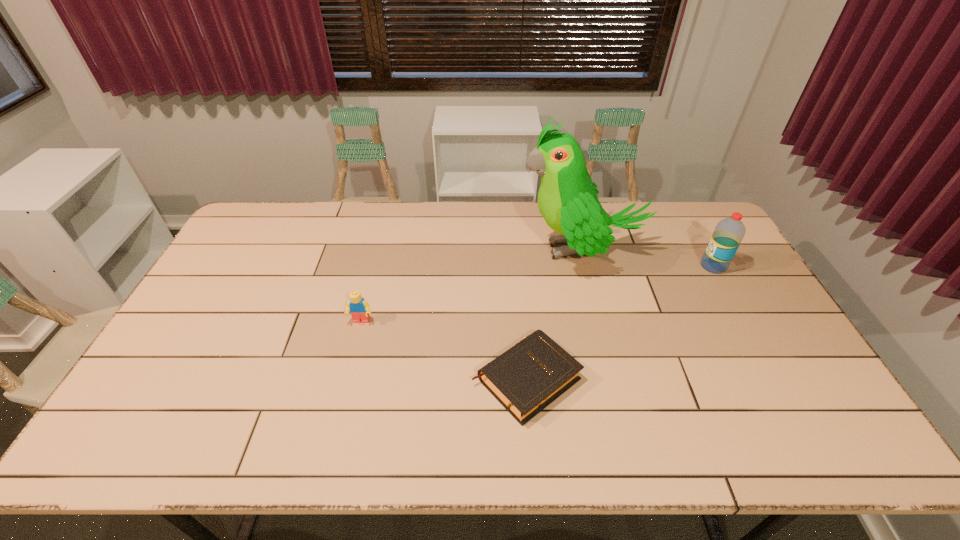
Locate an element on the screen. vacant point located between the second shortest object and the tallest object is located at coordinates (471, 285).

What are the coordinates of `empty space between the Bible and the water bottle` in the screenshot? It's located at (620, 322).

Locate an element on the screen. object that is the third closest to the water bottle is located at coordinates (359, 308).

Locate an element on the screen. object identified as the closest to the shortest object is located at coordinates (567, 199).

Locate an element on the screen. free point that satisfies the following two spatial constraints: 1. on the beak of the tallest object; 2. on the front side of the nearest object is located at coordinates (613, 379).

Identify the location of free location that satisfies the following two spatial constraints: 1. on the front-facing side of the shortest object; 2. on the left side of the Lego. (347, 379).

Identify the location of vacant space that satisfies the following two spatial constraints: 1. on the front-facing side of the shortest object; 2. on the left side of the second nearest object. (347, 379).

I want to click on vacant space that satisfies the following two spatial constraints: 1. on the beak of the parakeet; 2. on the front side of the Bible, so click(x=613, y=379).

Where is `free point that satisfies the following two spatial constraints: 1. on the beak of the parakeet; 2. on the front side of the nearest object`? free point that satisfies the following two spatial constraints: 1. on the beak of the parakeet; 2. on the front side of the nearest object is located at coordinates click(613, 379).

The height and width of the screenshot is (540, 960). Find the location of `free space that satisfies the following two spatial constraints: 1. on the front label of the third shortest object; 2. on the front side of the nearest object`. free space that satisfies the following two spatial constraints: 1. on the front label of the third shortest object; 2. on the front side of the nearest object is located at coordinates (777, 379).